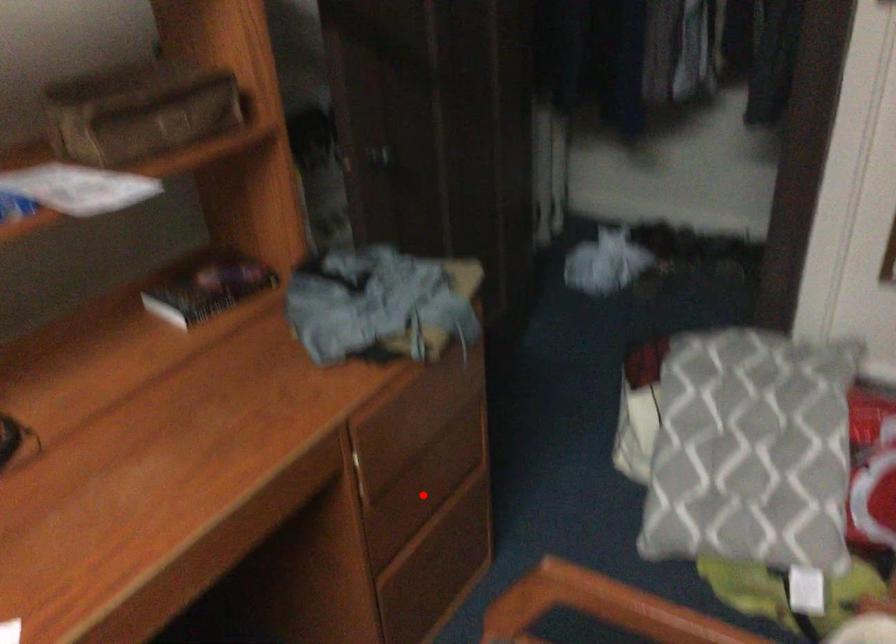
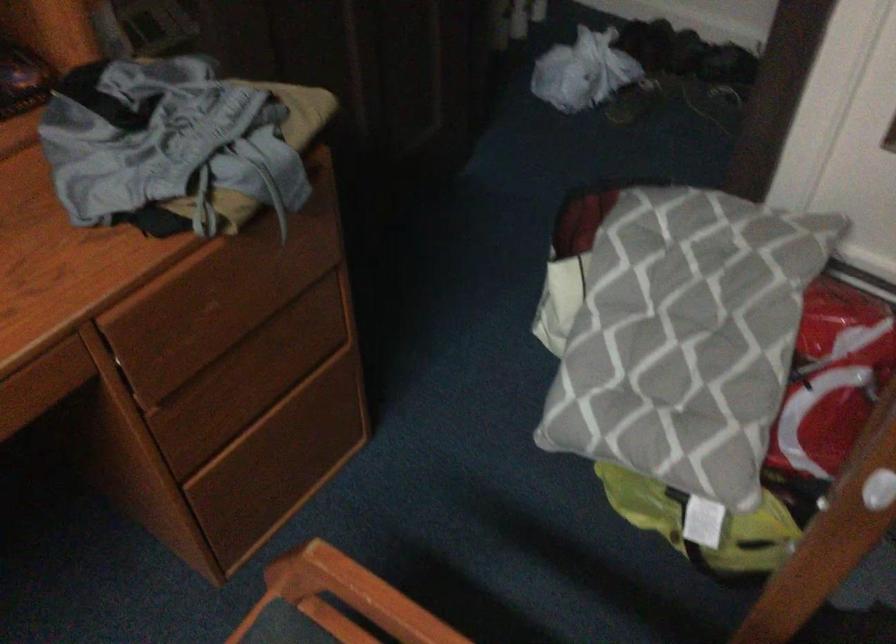
Question: A red point is marked in image1. In image2, is the corresponding 3D point closer to the camera or farther? Reply with the corresponding letter.

Choices:
 (A) The corresponding 3D point is closer.
 (B) The corresponding 3D point is farther.

Answer: (A)